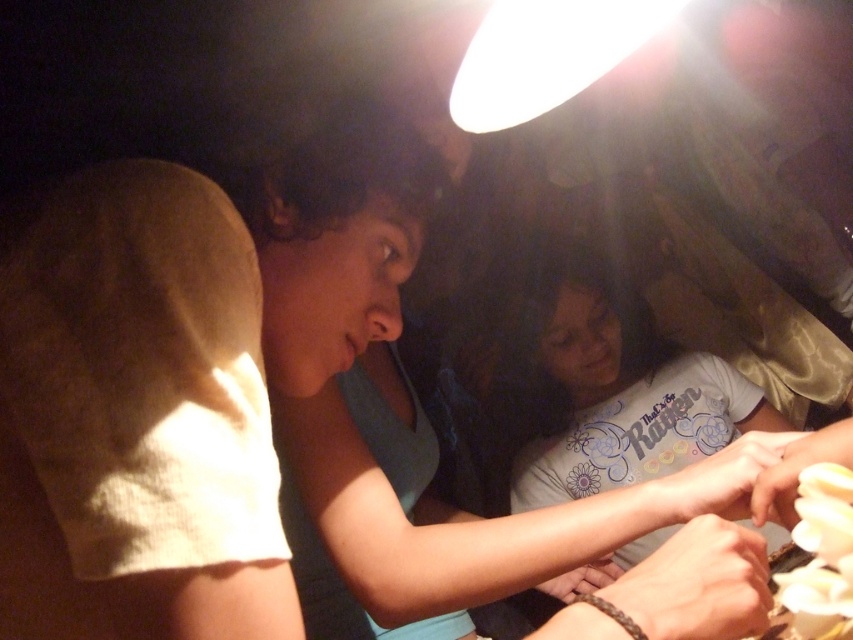
Does white glossy food at lower right lie in front of smooth yellow hand at lower right?

Yes, it is.

This screenshot has width=853, height=640. Identify the location of white glossy food at lower right. (821, 554).

In order to click on white glossy food at lower right in this screenshot , I will do `click(821, 554)`.

Who is lower down, brown leather bracelet at lower center or white glossy food at lower right?

brown leather bracelet at lower center is below.

Is point (732, 630) less distant than point (815, 502)?

No, it is not.

Where is `brown leather bracelet at lower center`? This screenshot has width=853, height=640. brown leather bracelet at lower center is located at coordinates (698, 584).

Which is behind, point (738, 492) or point (828, 442)?

The point (738, 492) is more distant.

Is point (764, 508) positioned before point (788, 497)?

No.

Locate an element on the screen. smooth skin hand at lower right is located at coordinates (732, 481).